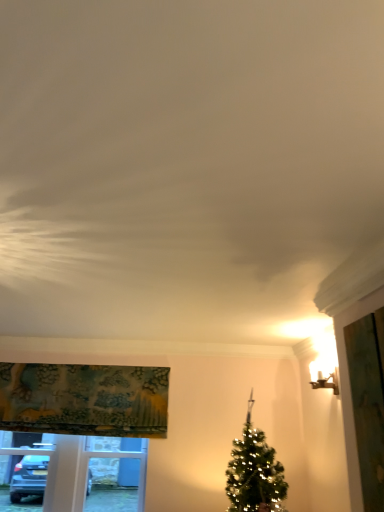
Describe the element at coordinates (327, 381) in the screenshot. The image size is (384, 512). I see `matte gold sconce at upper right` at that location.

Locate an element on the screen. textured fabric curtain at upper left is located at coordinates (84, 399).

In the scene shown: Would you say matte gold sconce at upper right is part of white plastic window frame at lower left's contents?

No, matte gold sconce at upper right is not surrounded by white plastic window frame at lower left.

Is white plastic window frame at lower left next to matte gold sconce at upper right?

No, white plastic window frame at lower left is not next to matte gold sconce at upper right.

Is white plastic window frame at lower left turned away from matte gold sconce at upper right?

No, white plastic window frame at lower left is not facing the opposite direction of matte gold sconce at upper right.

From the image's perspective, is white plastic window frame at lower left beneath matte gold sconce at upper right?

Yes, from the image's perspective, white plastic window frame at lower left is below matte gold sconce at upper right.

Can matte gold sconce at upper right be found inside green fabric screen door at right?

No, matte gold sconce at upper right is not a part of green fabric screen door at right.

Does green fabric screen door at right have a lesser height compared to matte gold sconce at upper right?

Incorrect, the height of green fabric screen door at right does not fall short of that of matte gold sconce at upper right.

From a real-world perspective, between green fabric screen door at right and matte gold sconce at upper right, who is vertically lower?

green fabric screen door at right is physically lower.

Is green fabric screen door at right behind matte gold sconce at upper right?

No.

Considering the sizes of objects green fabric screen door at right and textured fabric curtain at upper left in the image provided, who is thinner, green fabric screen door at right or textured fabric curtain at upper left?

Thinner between the two is green fabric screen door at right.

Which object is closer to the camera, green fabric screen door at right or textured fabric curtain at upper left?

green fabric screen door at right is closer to the camera.

In the image, there is a textured fabric curtain at upper left. Where is `screen door below it (from a real-world perspective)`? This screenshot has height=512, width=384. screen door below it (from a real-world perspective) is located at coordinates (368, 402).

From a real-world perspective, who is located lower, green fabric screen door at right or textured fabric curtain at upper left?

From a 3D spatial view, green fabric screen door at right is below.

Which of these two, textured fabric curtain at upper left or matte gold sconce at upper right, is thinner?

With smaller width is matte gold sconce at upper right.

In the scene shown: Considering the relative positions of textured fabric curtain at upper left and matte gold sconce at upper right in the image provided, is textured fabric curtain at upper left to the left or to the right of matte gold sconce at upper right?

textured fabric curtain at upper left is to the left of matte gold sconce at upper right.

From a real-world perspective, between textured fabric curtain at upper left and matte gold sconce at upper right, who is vertically lower?

textured fabric curtain at upper left, from a real-world perspective.

Which of these two, white plastic window frame at lower left or green fabric screen door at right, stands taller?

green fabric screen door at right.

From the picture: Considering their positions, is white plastic window frame at lower left located in front of or behind green fabric screen door at right?

white plastic window frame at lower left is positioned farther from the viewer than green fabric screen door at right.

From a real-world perspective, is white plastic window frame at lower left located beneath green fabric screen door at right?

Yes, from a real-world perspective, white plastic window frame at lower left is beneath green fabric screen door at right.

From the image's perspective, is matte gold sconce at upper right below textured fabric curtain at upper left?

No, from the image's perspective, matte gold sconce at upper right is not below textured fabric curtain at upper left.

What's the angular difference between matte gold sconce at upper right and textured fabric curtain at upper left's facing directions?

95 degrees separate the facing orientations of matte gold sconce at upper right and textured fabric curtain at upper left.

Looking at this image, measure the distance between matte gold sconce at upper right and textured fabric curtain at upper left.

matte gold sconce at upper right and textured fabric curtain at upper left are 6.10 feet apart.

Which object is more forward, matte gold sconce at upper right or textured fabric curtain at upper left?

Positioned in front is matte gold sconce at upper right.

Between green fabric screen door at right and white plastic window frame at lower left, which one is positioned in front?

green fabric screen door at right is in front.

Who is shorter, green fabric screen door at right or white plastic window frame at lower left?

white plastic window frame at lower left.

Locate an element on the screen. The width and height of the screenshot is (384, 512). window frame behind the green fabric screen door at right is located at coordinates (129, 458).

Considering the positions of points (358, 401) and (117, 451), is point (358, 401) closer to camera compared to point (117, 451)?

Yes, it is.

Identify the location of light fixture above the white plastic window frame at lower left (from a real-world perspective). The height and width of the screenshot is (512, 384). (327, 381).

I want to click on screen door located above the matte gold sconce at upper right (from the image's perspective), so click(368, 402).

Based on their spatial positions, is textured fabric curtain at upper left or green fabric screen door at right closer to white plastic window frame at lower left?

Among the two, textured fabric curtain at upper left is located nearer to white plastic window frame at lower left.

From the image, which object appears to be farther from green fabric screen door at right, matte gold sconce at upper right or textured fabric curtain at upper left?

textured fabric curtain at upper left lies further to green fabric screen door at right than the other object.

Which object lies nearer to the anchor point white plastic window frame at lower left, green fabric screen door at right or textured fabric curtain at upper left?

textured fabric curtain at upper left.

Considering their positions, is matte gold sconce at upper right positioned further to white plastic window frame at lower left than green fabric screen door at right?

The object further to white plastic window frame at lower left is green fabric screen door at right.

Considering their positions, is white plastic window frame at lower left positioned further to green fabric screen door at right than textured fabric curtain at upper left?

white plastic window frame at lower left is further to green fabric screen door at right.

Based on their spatial positions, is white plastic window frame at lower left or matte gold sconce at upper right further from green fabric screen door at right?

white plastic window frame at lower left.

Estimate the real-world distances between objects in this image. Which object is closer to green fabric screen door at right, textured fabric curtain at upper left or white plastic window frame at lower left?

Among the two, textured fabric curtain at upper left is located nearer to green fabric screen door at right.

Looking at this image, from the image, which object appears to be nearer to textured fabric curtain at upper left, green fabric screen door at right or matte gold sconce at upper right?

Based on the image, matte gold sconce at upper right appears to be nearer to textured fabric curtain at upper left.

Find the location of a particular element. Image resolution: width=384 pixels, height=512 pixels. light fixture positioned between green fabric screen door at right and textured fabric curtain at upper left from near to far is located at coordinates (x=327, y=381).

Image resolution: width=384 pixels, height=512 pixels. I want to click on light fixture between green fabric screen door at right and white plastic window frame at lower left from front to back, so click(327, 381).

At what (x,y) coordinates should I click in order to perform the action: click on curtain between green fabric screen door at right and white plastic window frame at lower left along the z-axis. Please return your answer as a coordinate pair (x, y). The width and height of the screenshot is (384, 512). Looking at the image, I should click on (84, 399).

This screenshot has height=512, width=384. Find the location of `curtain located between white plastic window frame at lower left and matte gold sconce at upper right in the left-right direction`. curtain located between white plastic window frame at lower left and matte gold sconce at upper right in the left-right direction is located at coordinates (84, 399).